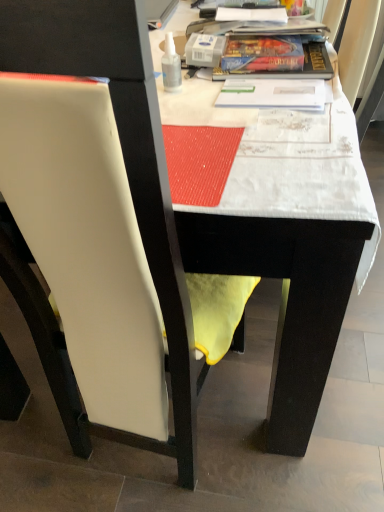
Question: Does point 211,343 appear closer or farther from the camera than point 226,115?

Choices:
 (A) closer
 (B) farther

Answer: (A)

Question: Considering the positions of white leather chair at left and white fabric table at upper center in the image, is white leather chair at left wider or thinner than white fabric table at upper center?

Choices:
 (A) thin
 (B) wide

Answer: (A)

Question: Which object is the closest to the white leather chair at left?

Choices:
 (A) transparent plastic bottle at upper center
 (B) white fabric table at upper center

Answer: (B)

Question: Which object is the farthest from the transparent plastic bottle at upper center?

Choices:
 (A) white fabric table at upper center
 (B) white leather chair at left

Answer: (B)